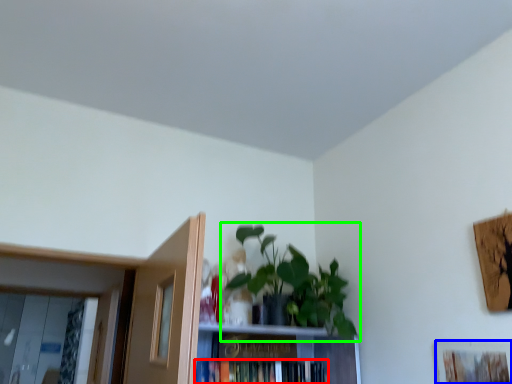
Question: Estimate the real-world distances between objects in this image. Which object is farther from book (highlighted by a red box), picture frame (highlighted by a blue box) or houseplant (highlighted by a green box)?

Choices:
 (A) picture frame
 (B) houseplant

Answer: (A)